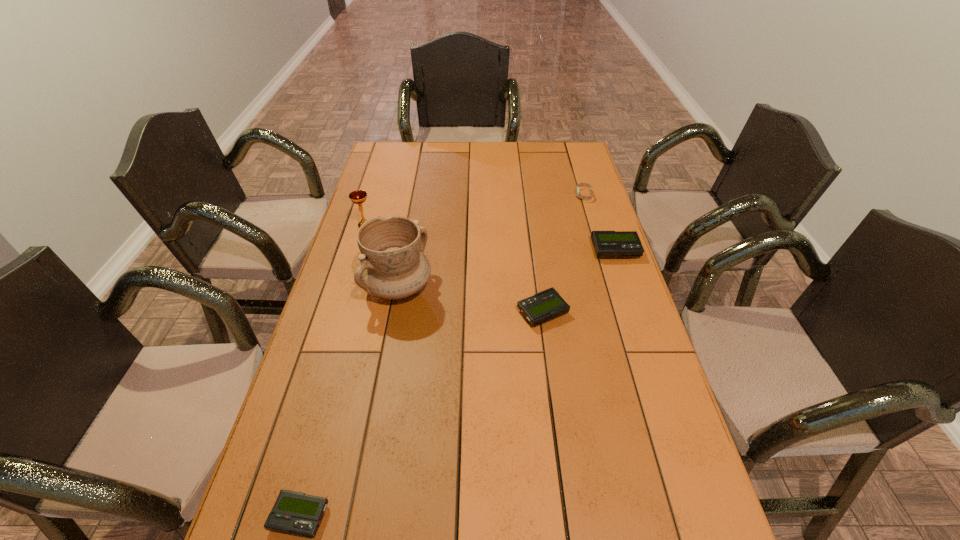
Image resolution: width=960 pixels, height=540 pixels. Find the location of `the third object from right to left`. the third object from right to left is located at coordinates (548, 304).

Identify the location of the second nearest beeper. (548, 304).

Where is `the farthest beeper`? The width and height of the screenshot is (960, 540). the farthest beeper is located at coordinates (606, 244).

The image size is (960, 540). I want to click on the tallest beeper, so click(x=606, y=244).

You are a GUI agent. You are given a task and a screenshot of the screen. Output one action in this format:
    pyautogui.click(x=<x>, y=<y>)
    Task: Click on the watch
    This screenshot has height=540, width=960.
    Given the screenshot: What is the action you would take?
    pyautogui.click(x=586, y=184)

Locate an element on the screen. This screenshot has height=540, width=960. chalice is located at coordinates (358, 197).

This screenshot has width=960, height=540. What are the coordinates of `the fifth nearest object` in the screenshot? It's located at (358, 197).

At what (x,y) coordinates should I click in order to perform the action: click on the tallest object. Please return your answer as a coordinate pair (x, y). This screenshot has width=960, height=540. Looking at the image, I should click on (392, 265).

Where is `free region located 0.120m on the right of the second farthest beeper`? free region located 0.120m on the right of the second farthest beeper is located at coordinates [x=611, y=312].

This screenshot has width=960, height=540. I want to click on vacant space situated on the left of the rightmost beeper, so click(x=476, y=251).